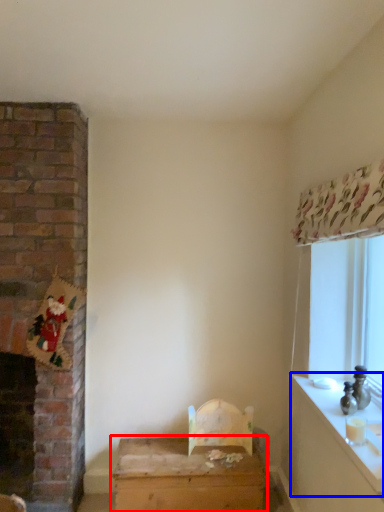
Question: Among these objects, which one is nearest to the camera, table (highlighted by a red box) or counter top (highlighted by a blue box)?

Choices:
 (A) table
 (B) counter top

Answer: (B)